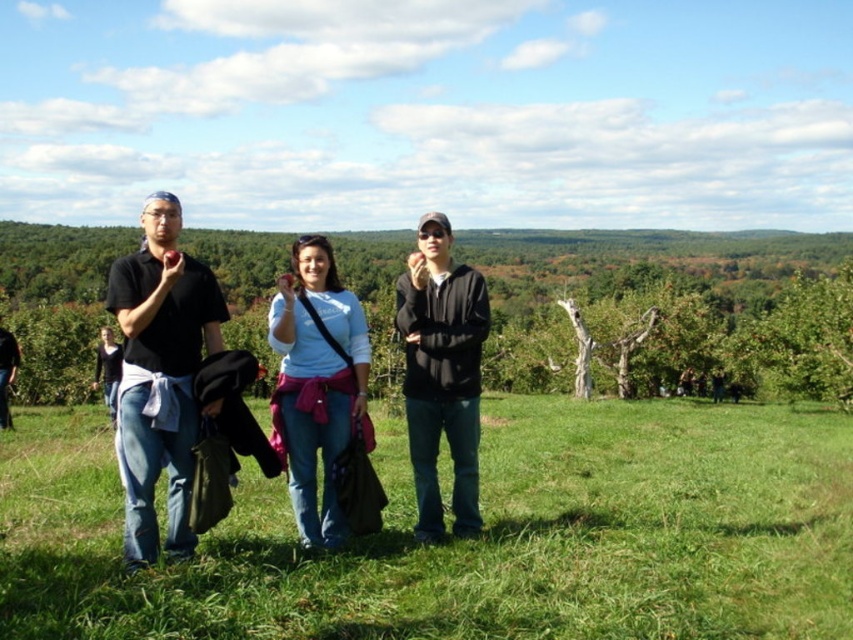
Question: Can you confirm if green grassy field at center is wider than light blue cotton shirt at center?

Choices:
 (A) yes
 (B) no

Answer: (A)

Question: Which point is closer to the camera?

Choices:
 (A) light blue cotton shirt at center
 (B) green grassy field at center

Answer: (B)

Question: Does green grassy field at center have a greater width compared to light blue cotton shirt at center?

Choices:
 (A) yes
 (B) no

Answer: (A)

Question: Which object is positioned closest to the light blue cotton shirt at center?

Choices:
 (A) matte black shirt at left
 (B) black matte jacket at center
 (C) green grassy field at center

Answer: (A)

Question: Which object appears closest to the camera in this image?

Choices:
 (A) black matte jacket at center
 (B) matte black shirt at left

Answer: (B)

Question: Can you confirm if light blue cotton shirt at center is positioned to the right of black matte jacket at center?

Choices:
 (A) yes
 (B) no

Answer: (B)